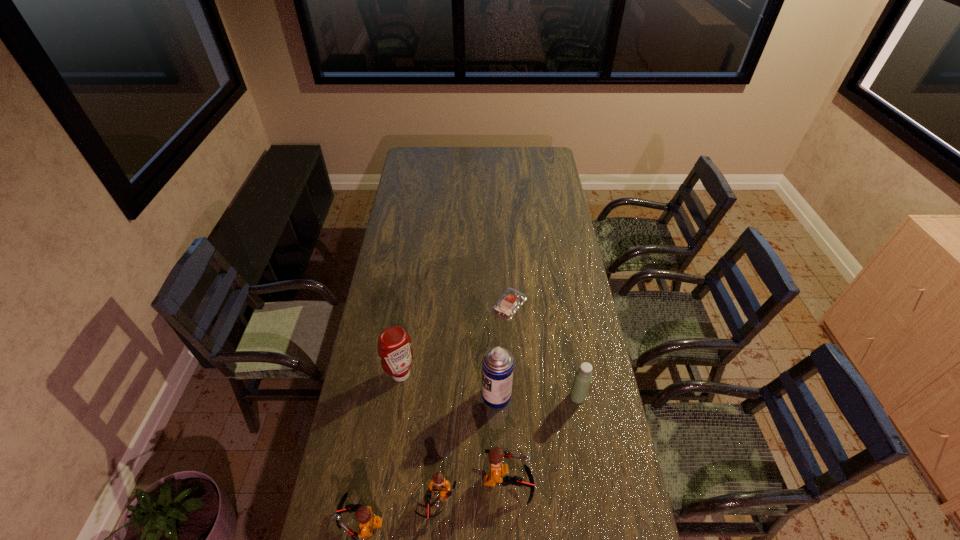
Identify which object is the third closest to the third shortest object. Please provide its 2D coordinates. Your answer should be formatted as a tuple, i.e. [(x, y)], where the tuple contains the x and y coordinates of a point satisfying the conditions above.

[(394, 343)]

Identify which object is the third nearest to the second tallest Lego. Please provide its 2D coordinates. Your answer should be formatted as a tuple, i.e. [(x, y)], where the tuple contains the x and y coordinates of a point satisfying the conditions above.

[(394, 343)]

The image size is (960, 540). Identify the location of Lego that stands as the third closest to the rightmost object. (368, 521).

The height and width of the screenshot is (540, 960). I want to click on the third closest Lego relative to the steak, so click(x=368, y=521).